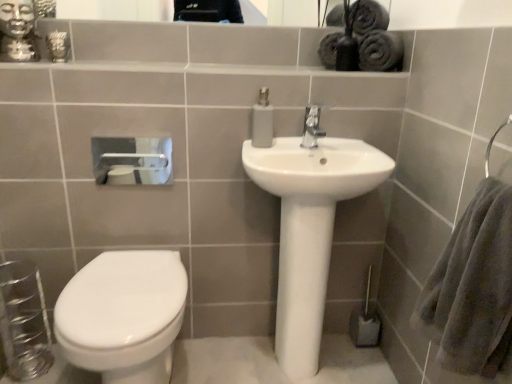
Question: From their relative heights in the image, would you say glossy ceramic mirror at upper center is taller or shorter than white matte toilet paper at upper left?

Choices:
 (A) short
 (B) tall

Answer: (A)

Question: From the image's perspective, is glossy ceramic mirror at upper center located above or below white matte toilet paper at upper left?

Choices:
 (A) above
 (B) below

Answer: (A)

Question: Which of these objects is positioned closest to the white matte toilet paper at upper left?

Choices:
 (A) silver metallic faucet at center
 (B) gold metallic statue at upper left
 (C) white glossy sink at center
 (D) matte gray plastic soap dispenser at upper center
 (E) glossy ceramic mirror at upper center

Answer: (B)

Question: Based on their relative distances, which object is farther from the gray fluffy bath towel at right?

Choices:
 (A) white matte toilet paper at upper left
 (B) glossy ceramic mirror at upper center
 (C) matte gray plastic soap dispenser at upper center
 (D) silver metallic faucet at center
 (E) gold metallic statue at upper left

Answer: (B)